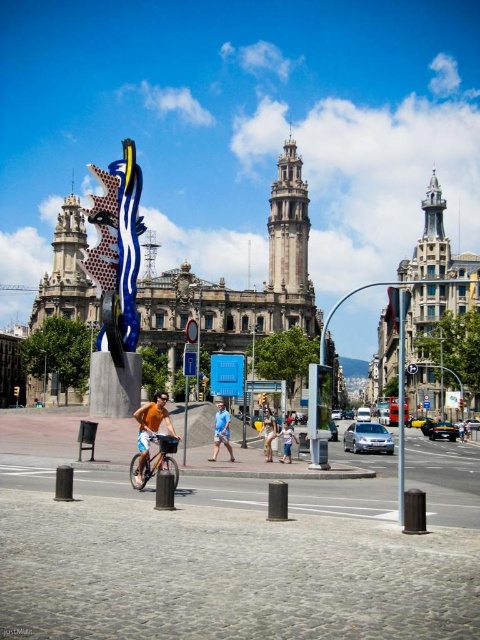
You are standing in the plaza and want to take a photo of the sculpture. You notice two points marked on the ground at coordinates point (228, 413) and point (264, 412). Which point should you stand closer to ensure the sculpture appears larger in your photo?

You should stand closer to point (228, 413) because it is closer to the camera, making the sculpture appear larger in the photo.